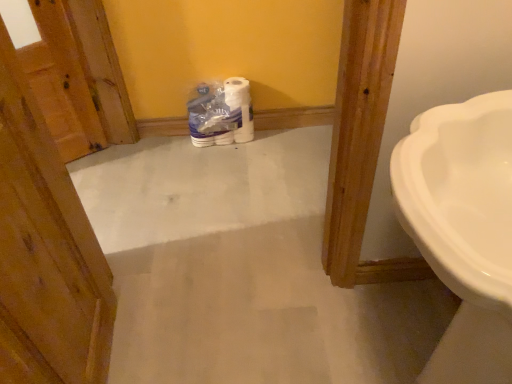
Question: In the image, is wooden door at left on the left side or the right side of white glossy toilet paper at center?

Choices:
 (A) left
 (B) right

Answer: (A)

Question: Considering their positions, is wooden door at left located in front of or behind white glossy toilet paper at center?

Choices:
 (A) behind
 (B) front

Answer: (B)

Question: Which object is positioned closest to the wooden door at left?

Choices:
 (A) white glossy sink at right
 (B) white glossy toilet paper at center

Answer: (A)

Question: Considering the real-world distances, which object is farthest from the white glossy sink at right?

Choices:
 (A) wooden door at left
 (B) white glossy toilet paper at center

Answer: (B)